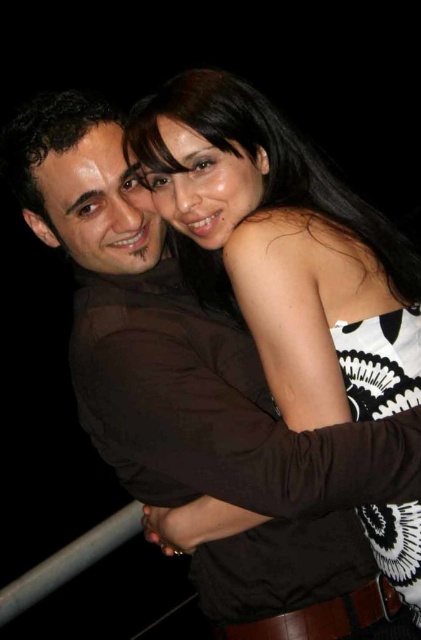
Is black and white printed dress at center positioned behind dark brown hair at left?

Yes, black and white printed dress at center is behind dark brown hair at left.

Can you confirm if black and white printed dress at center is positioned below dark brown hair at left?

Indeed, black and white printed dress at center is positioned under dark brown hair at left.

Describe the element at coordinates (381, 362) in the screenshot. This screenshot has height=640, width=421. I see `black and white printed dress at center` at that location.

Where is `black and white printed dress at center`? The image size is (421, 640). black and white printed dress at center is located at coordinates (381, 362).